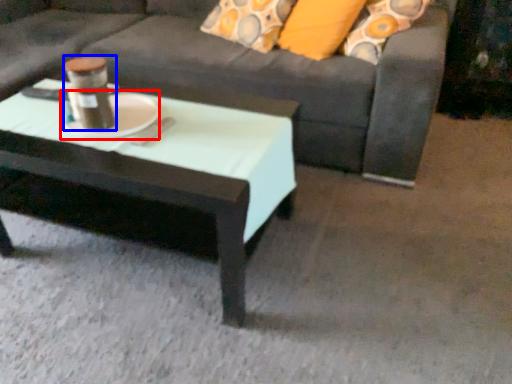
Question: Which point is closer to the camera, platter (highlighted by a red box) or beverage (highlighted by a blue box)?

Choices:
 (A) platter
 (B) beverage

Answer: (B)